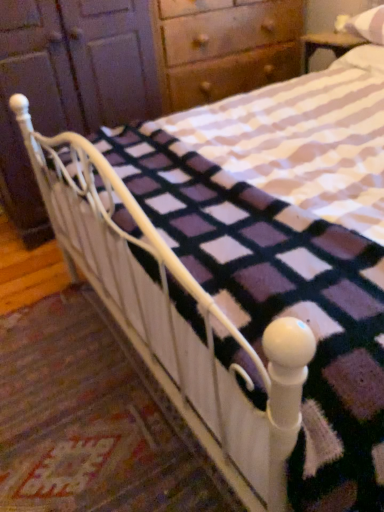
Question: Is matte wood dresser at upper left bigger than white cotton pillow at upper right, positioned as the first pillow in bottom-to-top order?

Choices:
 (A) yes
 (B) no

Answer: (A)

Question: From the image's perspective, is matte wood dresser at upper left above white cotton pillow at upper right, which is the 2th pillow from top to bottom?

Choices:
 (A) yes
 (B) no

Answer: (B)

Question: Considering the relative sizes of matte wood dresser at upper left and white cotton pillow at upper right, which is the 2th pillow from top to bottom, in the image provided, is matte wood dresser at upper left taller than white cotton pillow at upper right, which is the 2th pillow from top to bottom,?

Choices:
 (A) yes
 (B) no

Answer: (A)

Question: Can you confirm if matte wood dresser at upper left is shorter than white cotton pillow at upper right, positioned as the first pillow in bottom-to-top order?

Choices:
 (A) yes
 (B) no

Answer: (B)

Question: Is matte wood dresser at upper left smaller than white cotton pillow at upper right, positioned as the first pillow in bottom-to-top order?

Choices:
 (A) no
 (B) yes

Answer: (A)

Question: From the image's perspective, is matte wood dresser at upper left below white cotton pillow at upper right, positioned as the first pillow in bottom-to-top order?

Choices:
 (A) no
 (B) yes

Answer: (B)

Question: Does white soft pillow at upper right, which is counted as the 1th pillow, starting from the top, have a lesser height compared to matte wood dresser at upper left?

Choices:
 (A) yes
 (B) no

Answer: (A)

Question: Can you confirm if white soft pillow at upper right, which is counted as the 1th pillow, starting from the top, is wider than matte wood dresser at upper left?

Choices:
 (A) no
 (B) yes

Answer: (A)

Question: Does white soft pillow at upper right, the second pillow when ordered from bottom to top, have a larger size compared to matte wood dresser at upper left?

Choices:
 (A) no
 (B) yes

Answer: (A)

Question: Can you confirm if white soft pillow at upper right, the second pillow when ordered from bottom to top, is taller than matte wood dresser at upper left?

Choices:
 (A) yes
 (B) no

Answer: (B)

Question: Is there a large distance between white soft pillow at upper right, the second pillow when ordered from bottom to top, and matte wood dresser at upper left?

Choices:
 (A) no
 (B) yes

Answer: (A)

Question: Is white soft pillow at upper right, which is counted as the 1th pillow, starting from the top, at the right side of matte wood dresser at upper left?

Choices:
 (A) no
 (B) yes

Answer: (B)

Question: Does white cotton pillow at upper right, which is the 2th pillow from top to bottom, touch matte wood dresser at upper left?

Choices:
 (A) yes
 (B) no

Answer: (B)